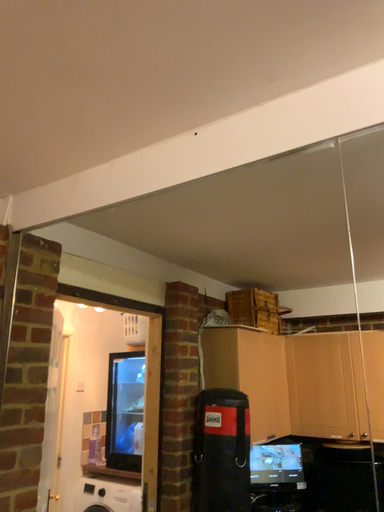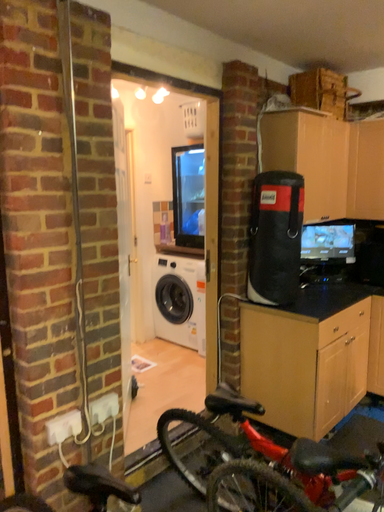
Question: Which way did the camera rotate in the video?

Choices:
 (A) rotated left
 (B) rotated right

Answer: (A)